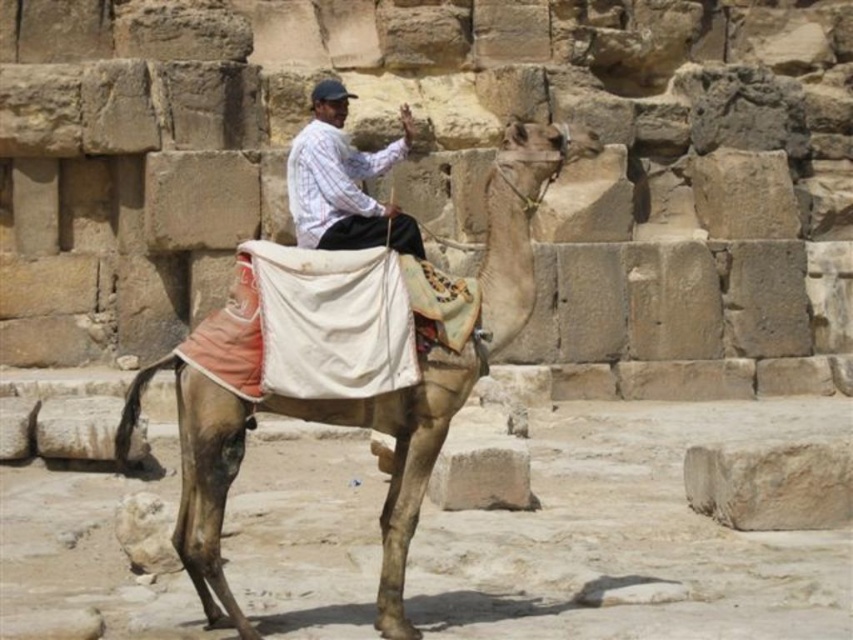
Does brown textured camel at center have a smaller size compared to white striped shirt at center?

Actually, brown textured camel at center might be larger than white striped shirt at center.

Does brown textured camel at center have a lesser height compared to white striped shirt at center?

No, brown textured camel at center is not shorter than white striped shirt at center.

Is point (518, 264) in front of point (410, 134)?

Yes, point (518, 264) is in front of point (410, 134).

Find the location of a particular element. The height and width of the screenshot is (640, 853). brown textured camel at center is located at coordinates (396, 464).